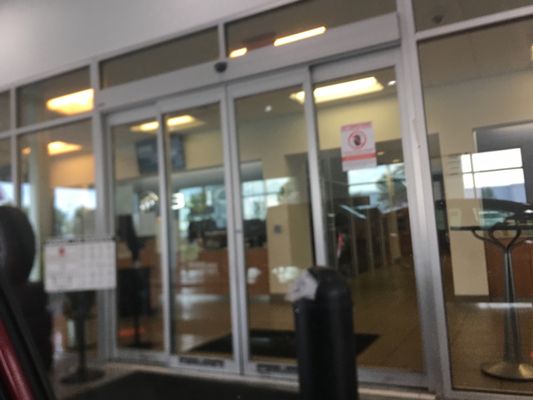
The width and height of the screenshot is (533, 400). What are the coordinates of `glass` in the screenshot? It's located at (477, 137), (347, 173), (269, 217), (214, 234), (138, 246), (87, 211), (10, 167).